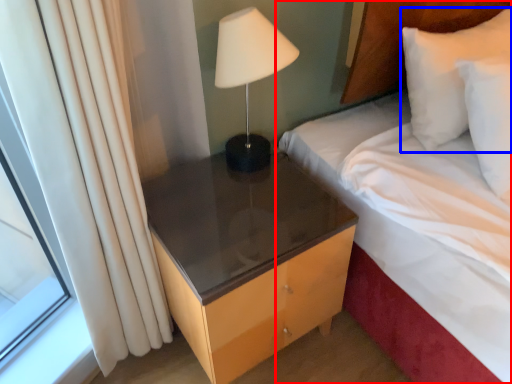
Question: Which point is closer to the camera, bed (highlighted by a red box) or pillow (highlighted by a blue box)?

Choices:
 (A) bed
 (B) pillow

Answer: (A)